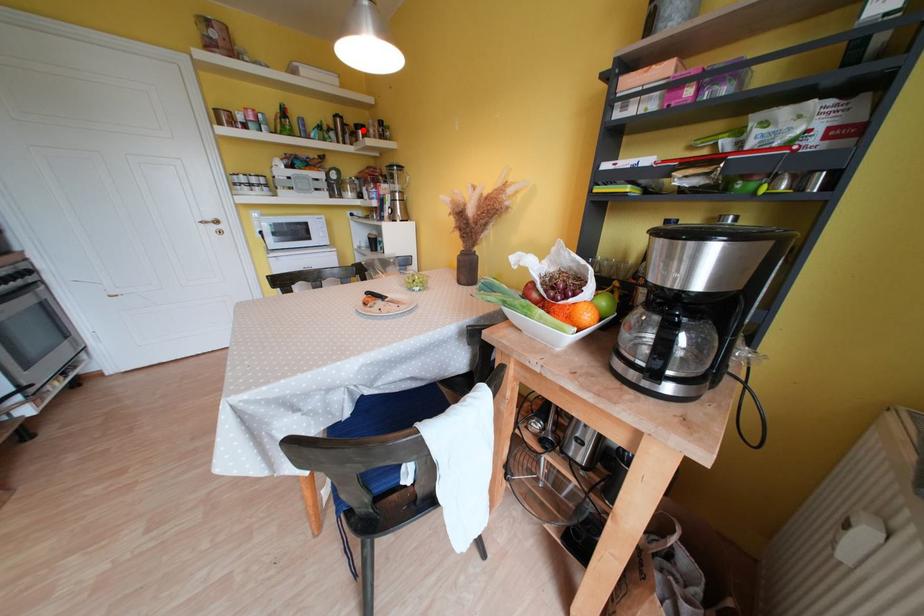
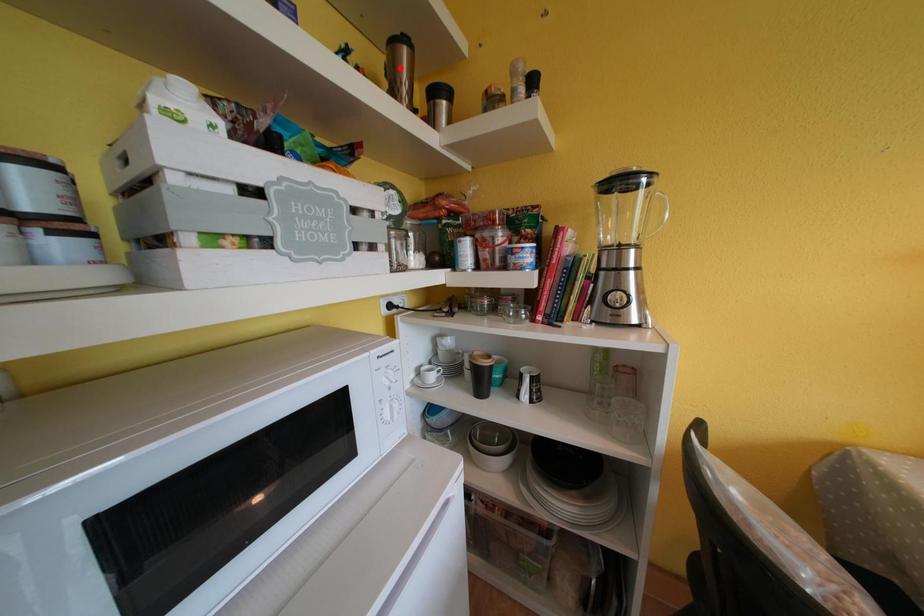
I am providing you with two images of the same scene from different viewpoints. A red point is marked on the first image and another point is marked on the second image. Are the points marked in image1 and image2 representing the same 3D position?

No